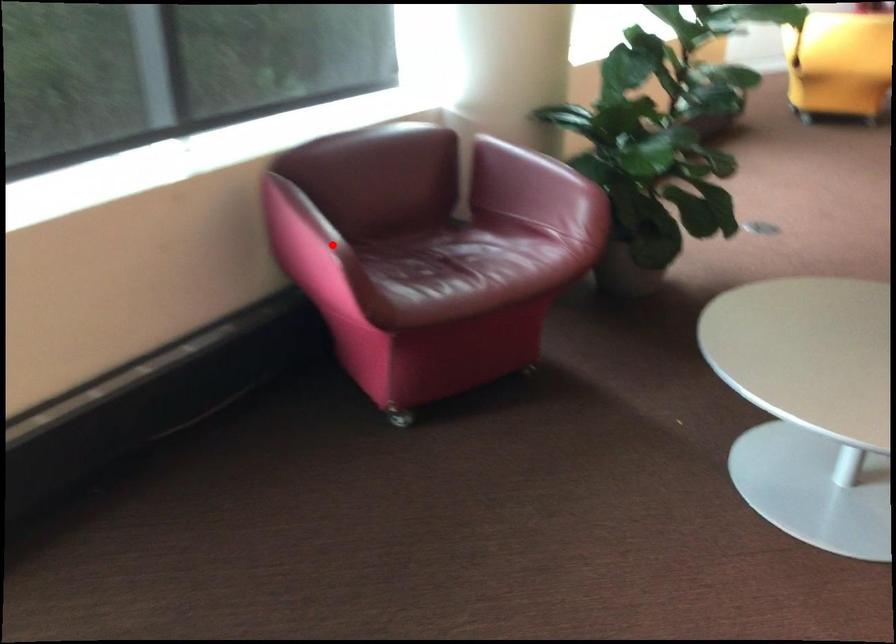
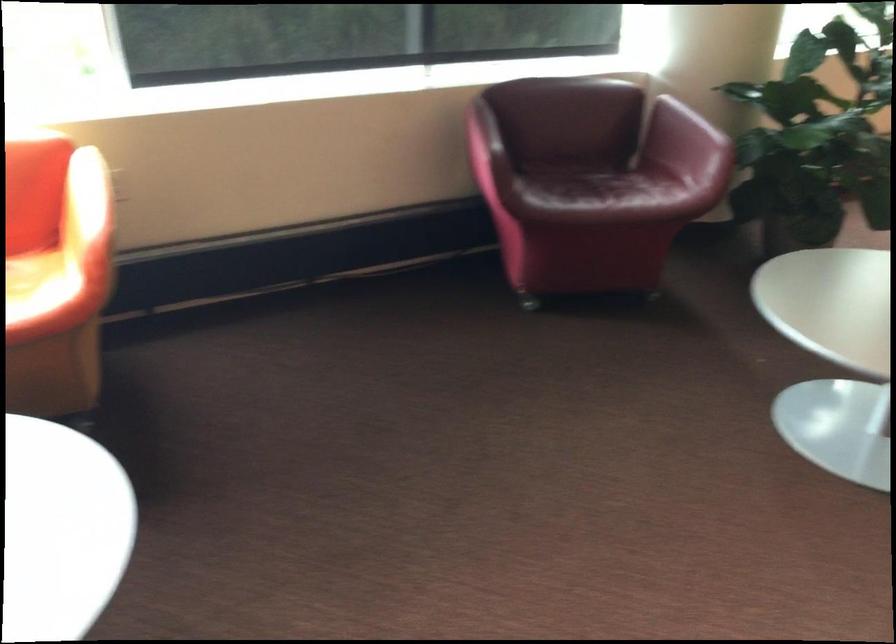
Locate, in the second image, the point that corresponds to the highlighted location in the first image.

(483, 140)